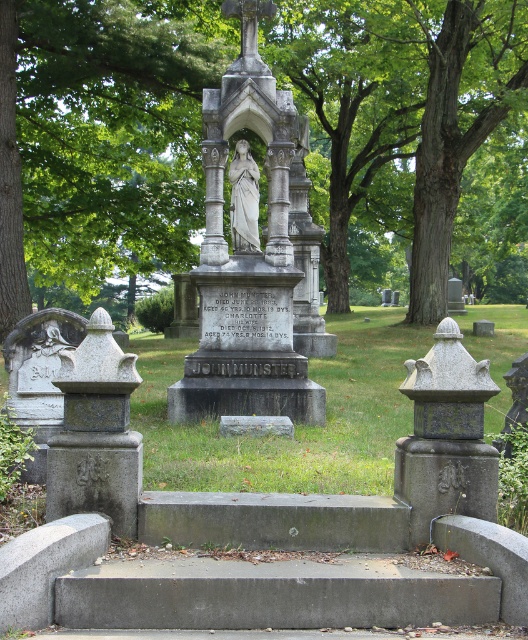
Question: Which point appears closest to the camera in this image?

Choices:
 (A) (281, 45)
 (B) (259, 61)

Answer: (B)

Question: Can you confirm if green leafy tree at center is smaller than white marble statue at center?

Choices:
 (A) no
 (B) yes

Answer: (A)

Question: From the image, what is the correct spatial relationship of polished stone statue at center in relation to white marble statue at center?

Choices:
 (A) above
 (B) below

Answer: (A)

Question: Does polished stone statue at center have a greater width compared to white marble statue at center?

Choices:
 (A) yes
 (B) no

Answer: (A)

Question: Which of these objects is positioned farthest from the white marble statue at center?

Choices:
 (A) polished stone statue at center
 (B) green leafy tree at center

Answer: (B)

Question: Which object is the farthest from the green leafy tree at center?

Choices:
 (A) white marble statue at center
 (B) polished stone statue at center

Answer: (A)